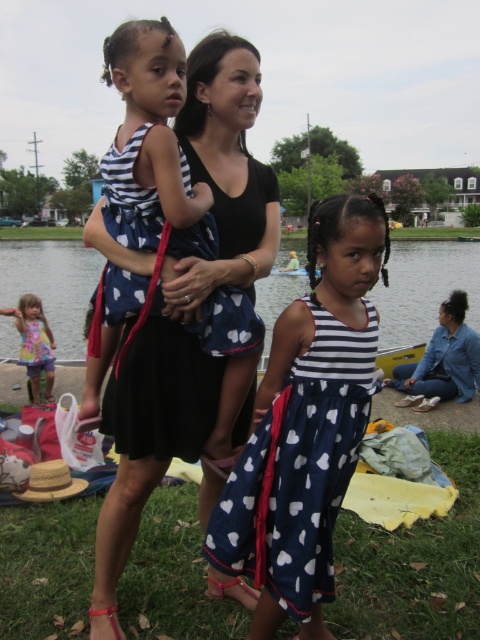
Question: Which of the following is the closest to the observer?

Choices:
 (A) green grass at lower center
 (B) clear water at center
 (C) pastel striped dress at lower left
 (D) blue cotton dress at center

Answer: (D)

Question: Which point is farther from the camera taking this photo?

Choices:
 (A) (47, 362)
 (B) (453, 244)
 (C) (276, 420)
 (D) (126, 396)

Answer: (B)

Question: Does navy blue cotton dress at center appear over clear water at center?

Choices:
 (A) yes
 (B) no

Answer: (B)

Question: Does black matte dress at center appear on the right side of green grass at lower center?

Choices:
 (A) no
 (B) yes

Answer: (A)

Question: Is navy blue cotton dress at center to the right of pastel striped dress at lower left from the viewer's perspective?

Choices:
 (A) yes
 (B) no

Answer: (A)

Question: Which point is farther from the camera taking this photo?

Choices:
 (A) (419, 637)
 (B) (45, 336)
 (C) (134, 502)
 (D) (12, 273)

Answer: (D)